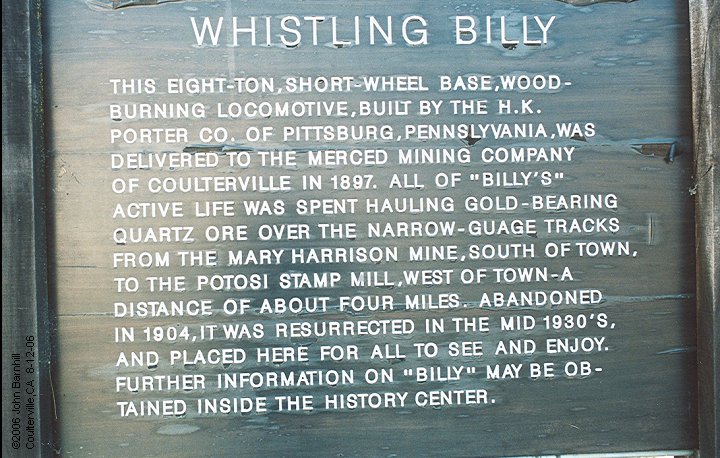
Locate an element on the screen. The image size is (720, 458). dark wood frame is located at coordinates (19, 213), (702, 170).